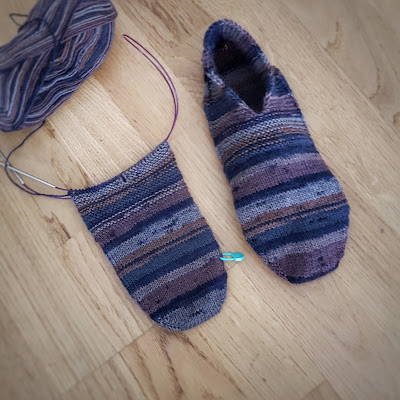
Where is `purplish strand of yarn coming out of unfinished slipper`? purplish strand of yarn coming out of unfinished slipper is located at coordinates (168, 78).